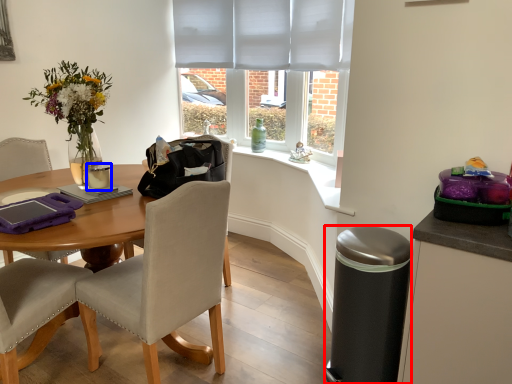
Question: Which point is further to the camera, trash bin/can (highlighted by a red box) or coffee cup (highlighted by a blue box)?

Choices:
 (A) trash bin/can
 (B) coffee cup

Answer: (B)